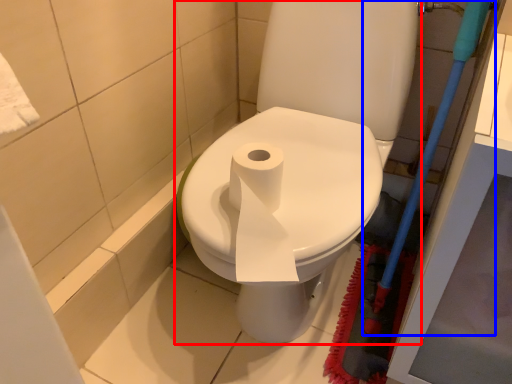
Question: Which point is further to the camera, toilet (highlighted by a red box) or brush (highlighted by a blue box)?

Choices:
 (A) toilet
 (B) brush

Answer: (A)